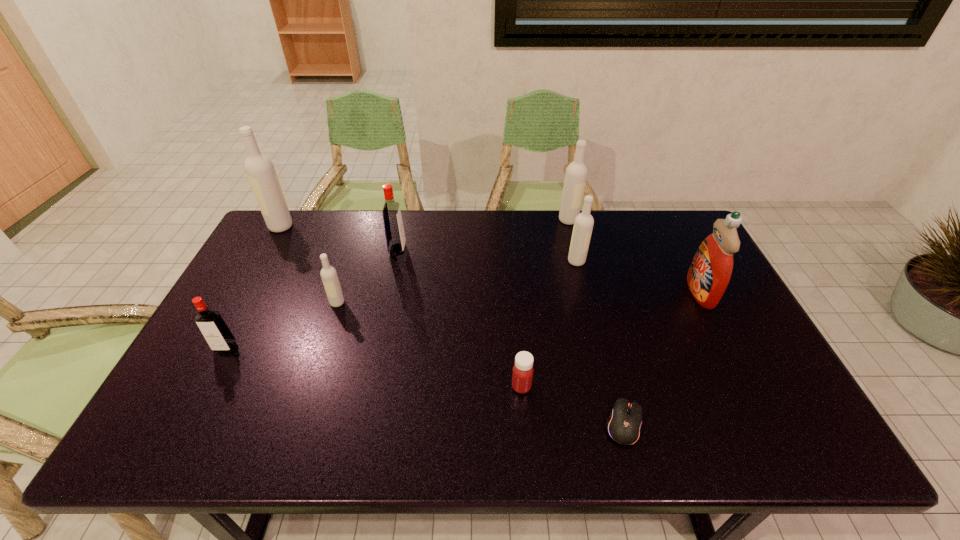
At what (x,y) coordinates should I click in order to perform the action: click on the nearer red vodka. Please return your answer as a coordinate pair (x, y). The width and height of the screenshot is (960, 540). Looking at the image, I should click on (219, 337).

Find the location of a particular element. the left red vodka is located at coordinates (219, 337).

The height and width of the screenshot is (540, 960). Find the location of `the eighth farthest object`. the eighth farthest object is located at coordinates (522, 375).

The width and height of the screenshot is (960, 540). In order to click on the fifth object from left to right in this screenshot , I will do `click(522, 375)`.

This screenshot has height=540, width=960. Find the location of `black computer mouse`. black computer mouse is located at coordinates (624, 424).

You are a GUI agent. You are given a task and a screenshot of the screen. Output one action in this format:
    pyautogui.click(x=<x>, y=<y>)
    Task: Click on the computer mouse
    The height and width of the screenshot is (540, 960).
    Given the screenshot: What is the action you would take?
    pyautogui.click(x=624, y=424)

Where is `vacant space situated 0.210m on the right of the biggest white vodka`? vacant space situated 0.210m on the right of the biggest white vodka is located at coordinates (353, 226).

At what (x,y) coordinates should I click in order to perform the action: click on free space located on the right of the second biggest white vodka. Please return your answer as a coordinate pair (x, y). This screenshot has height=540, width=960. Looking at the image, I should click on (660, 220).

What are the coordinates of `vacant space situated on the front surface of the rightmost object` in the screenshot? It's located at (566, 292).

At what (x,y) coordinates should I click in order to perform the action: click on free region located on the front surface of the rightmost object. Please return your answer as a coordinate pair (x, y). Looking at the image, I should click on (631, 292).